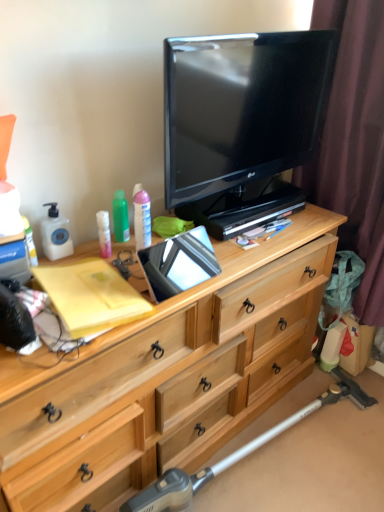
Locate an element on the screen. The height and width of the screenshot is (512, 384). vacant space underneath metallic silver vacuum cleaner at lower right (from a real-world perspective) is located at coordinates (286, 448).